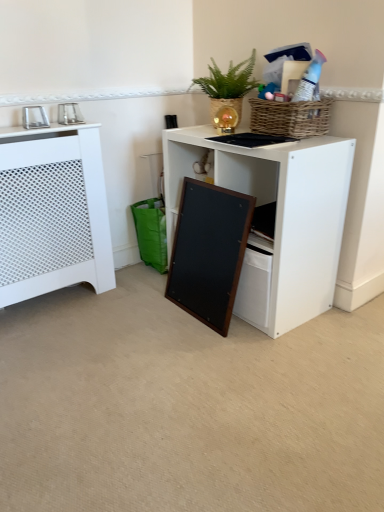
This screenshot has height=512, width=384. I want to click on vacant space in front of metallic silver photo frame at upper left, the first appliance viewed from the left, so click(x=19, y=135).